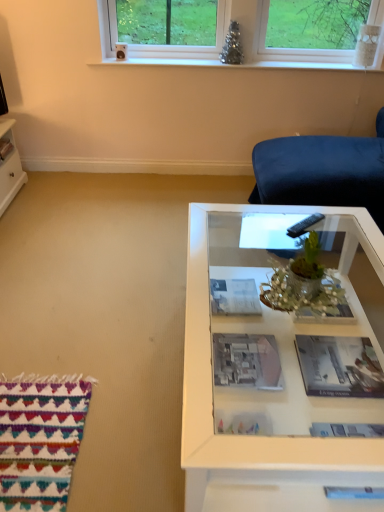
Question: Which is correct: matte paper magazine at center, the 1th magazine positioned from the top, is inside clear glass window at upper center, or outside of it?

Choices:
 (A) inside
 (B) outside

Answer: (B)

Question: Is matte paper magazine at center, which is the 2th magazine in right-to-left order, bigger or smaller than clear glass window at upper center?

Choices:
 (A) small
 (B) big

Answer: (A)

Question: Which is nearer to the matte gray magazine at lower right, which is counted as the 1th magazine, starting from the bottom?

Choices:
 (A) matte gray book at center, which appears as the second book when viewed from the left
 (B) clear glass window at upper center
 (C) matte paper magazine at center, which is the 2th magazine in right-to-left order
 (D) white glass table at center
 (E) black plastic remote at center

Answer: (D)

Question: Which is farther from the clear glass window at upper center?

Choices:
 (A) matte gray magazine at lower right, which is counted as the first magazine, starting from the right
 (B) black plastic remote at center
 (C) matte black book at lower left, the 2th book positioned from the bottom
 (D) matte gray book at center, positioned as the first book in right-to-left order
 (E) white glass table at center

Answer: (A)